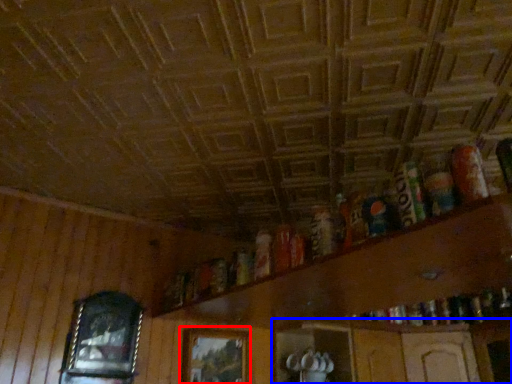
Question: Which object is closer to the camera taking this photo, picture frame (highlighted by a red box) or shelf (highlighted by a blue box)?

Choices:
 (A) picture frame
 (B) shelf

Answer: (A)